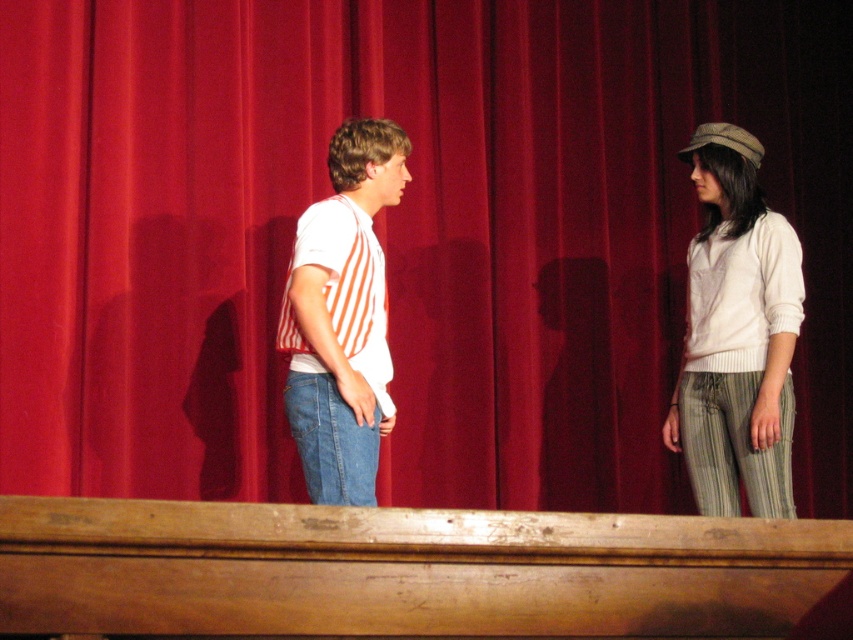
Is white knit sweater at right thinner than white striped shirt at center?

No, white knit sweater at right is not thinner than white striped shirt at center.

Which is in front, point (740, 384) or point (289, 364)?

Point (289, 364)

Which is in front, point (693, 314) or point (308, 282)?

Positioned in front is point (308, 282).

Locate an element on the screen. white knit sweater at right is located at coordinates (735, 333).